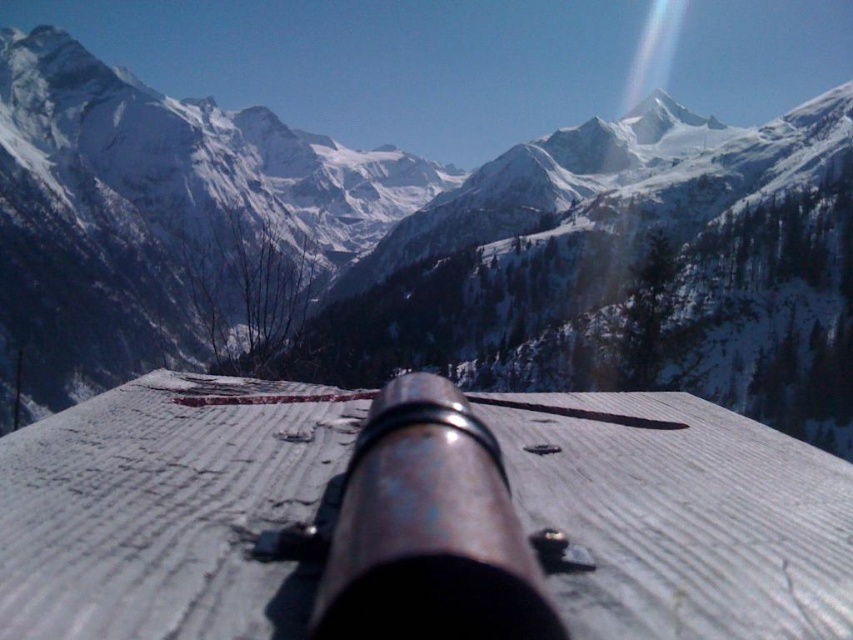
Does snowy rocky mountain range at upper center have a larger size compared to rusty metal cannon at center?

Indeed, snowy rocky mountain range at upper center has a larger size compared to rusty metal cannon at center.

Which is in front, point (207, 285) or point (384, 397)?

Point (384, 397) is more forward.

Locate an element on the screen. Image resolution: width=853 pixels, height=640 pixels. snowy rocky mountain range at upper center is located at coordinates (415, 248).